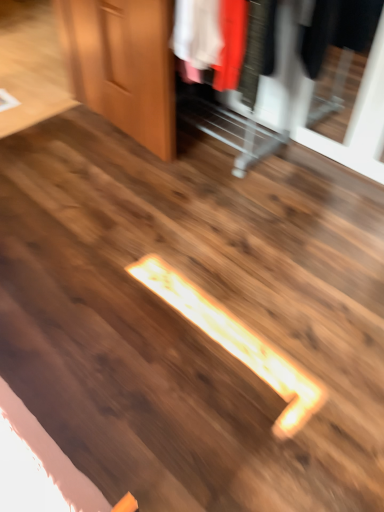
Image resolution: width=384 pixels, height=512 pixels. I want to click on empty space that is to the right of wooden door at upper left, so click(210, 150).